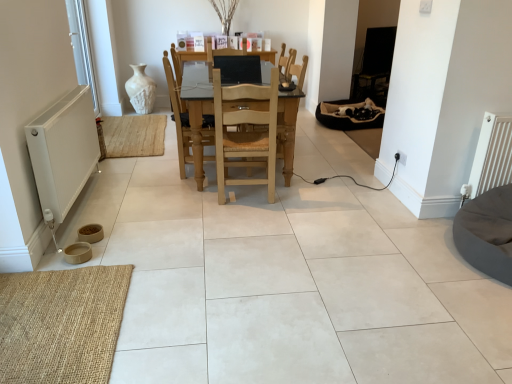
In order to click on vacant region below white matte radiator at lower left (from a real-world perspective) in this screenshot , I will do `click(80, 215)`.